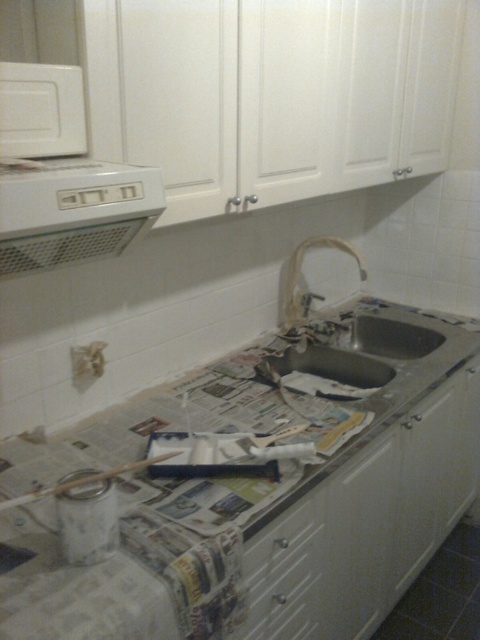
You are a painter standing in front of the kitchen scene described. You want to place a 30 inch long ladder on the white glossy countertop at center. Will the ladder fit on the countertop?

The white glossy countertop at center is 29.91 inches away from the camera, so the ladder is slightly longer than the countertop. The ladder will not fit on the white glossy countertop at center.

You are standing in the kitchen and need to reach two points marked on the wall. The first point is at coordinate point [62,260] and the second is at point [305,632]. Which point is closer to you?

Point [62,260] is closer to the viewer than point [305,632].

In the kitchen scene, you see a white glossy countertop at center and a white plastic exhaust hood at upper left. From the perspective of someone standing in front of the kitchen, which object is positioned to the right?

The white glossy countertop at center is to the right of the white plastic exhaust hood at upper left.